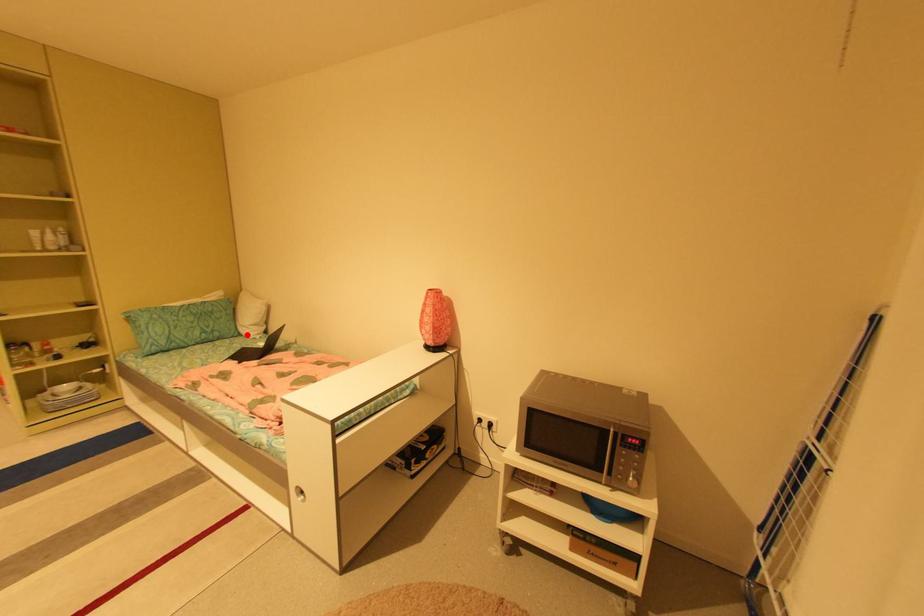
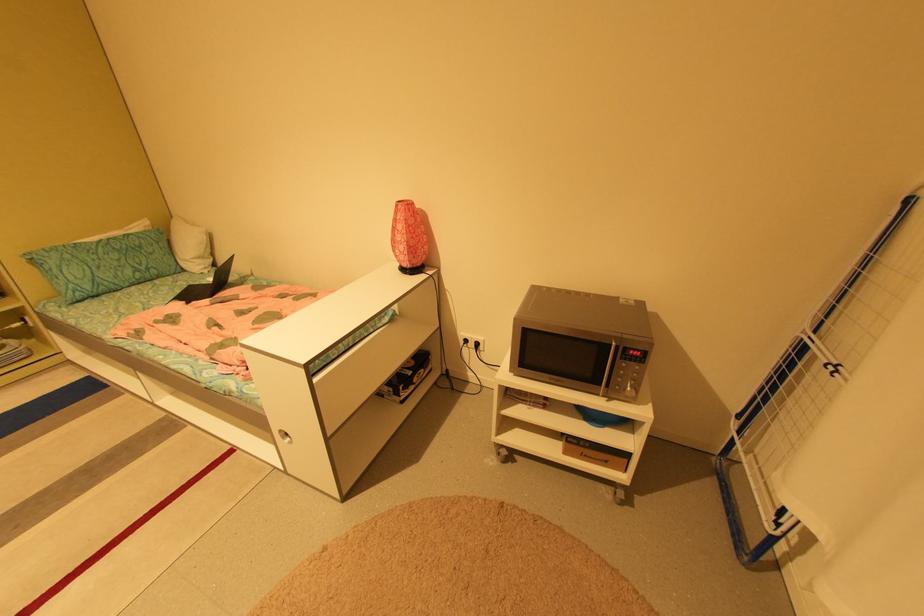
Question: I am providing you with two images of the same scene from different viewpoints. Image1 has a red point marked. In image2, the corresponding 3D location appears at what relative position? Reply with the corresponding letter.

Choices:
 (A) Closer
 (B) Farther

Answer: (A)